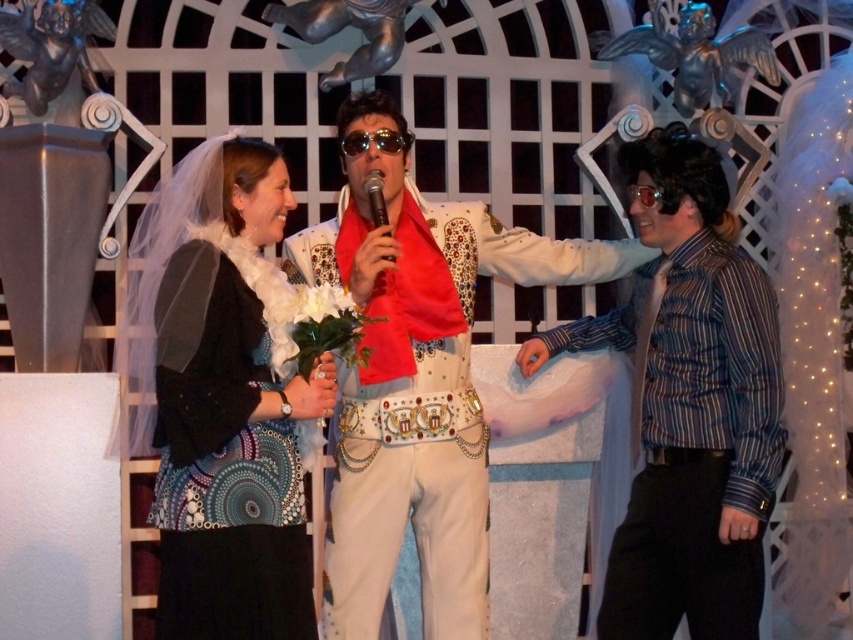
Question: Which point is closer to the camera?

Choices:
 (A) metallic silver microphone at center
 (B) sunglasses at center

Answer: (A)

Question: Can you confirm if shiny sequined jacket at center is thinner than metallic silver microphone at center?

Choices:
 (A) no
 (B) yes

Answer: (A)

Question: Which point is closer to the camera?

Choices:
 (A) shiny sequined jacket at center
 (B) black textured dress at center
 (C) striped shirt at right
 (D) metallic silver microphone at center

Answer: (B)

Question: Does black textured dress at center appear over metallic silver microphone at center?

Choices:
 (A) yes
 (B) no

Answer: (B)

Question: Which point is closer to the camera?

Choices:
 (A) (370, 196)
 (B) (282, 259)
 (C) (679, 141)
 (D) (207, 429)

Answer: (D)

Question: Can you confirm if matte black dress at center is positioned to the right of striped shirt at right?

Choices:
 (A) no
 (B) yes

Answer: (A)